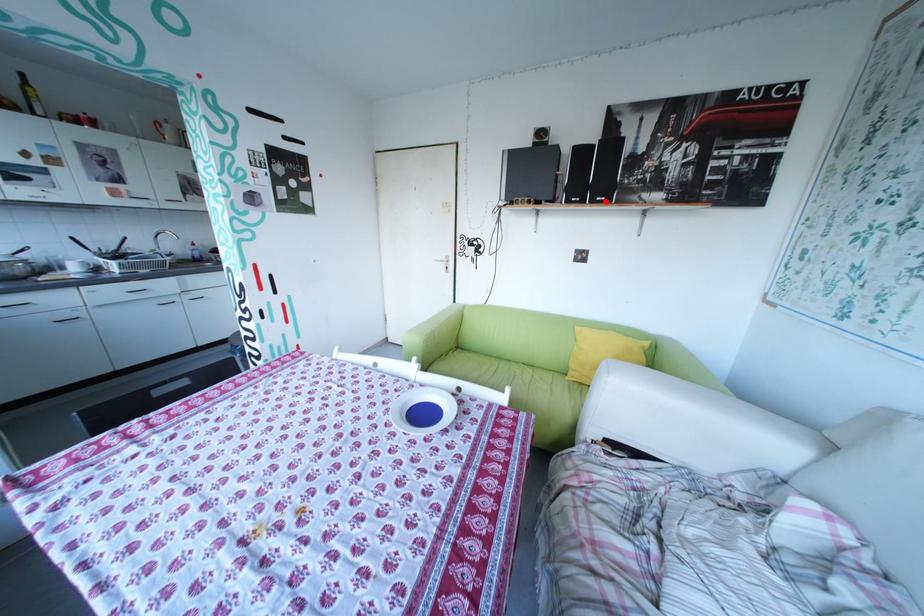
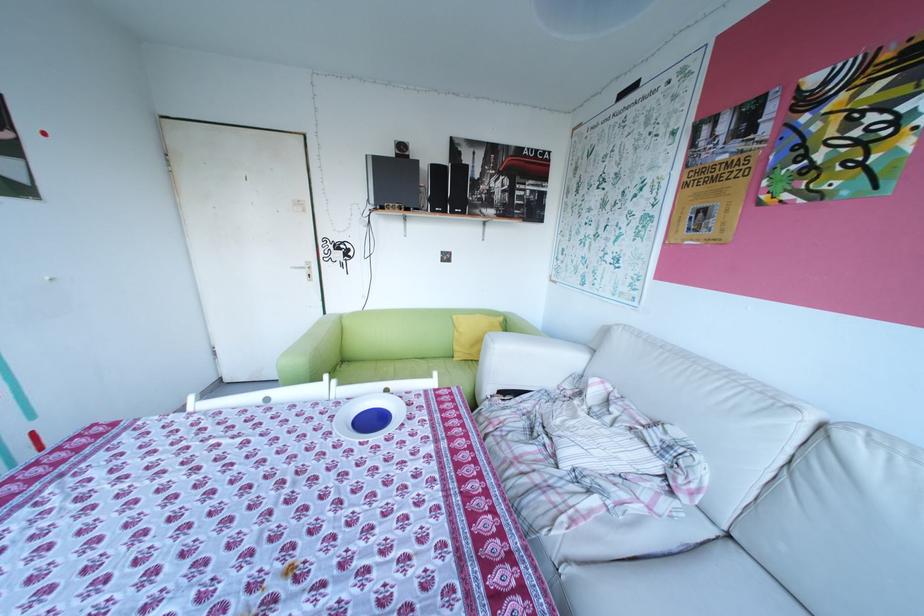
Find the pixel in the second image that matches the highlighted location in the first image.

(466, 212)